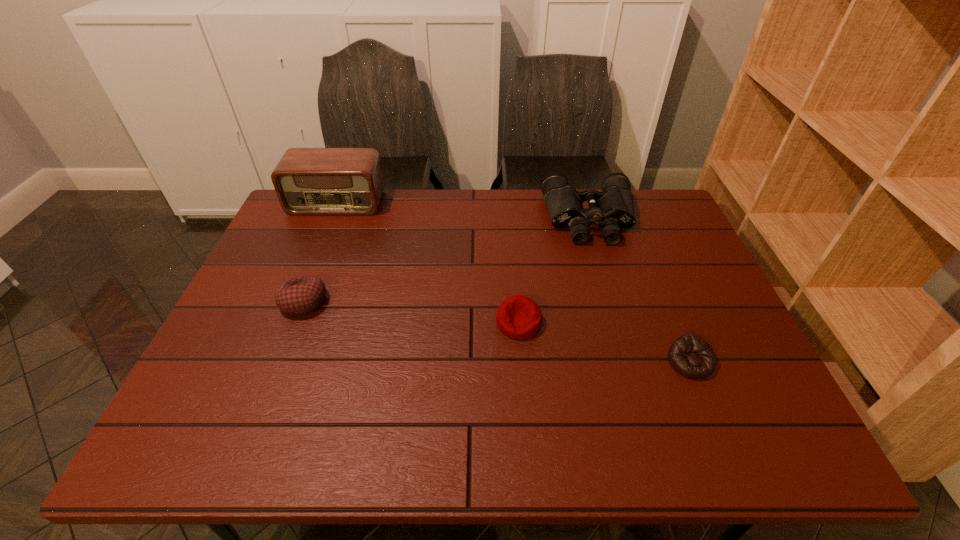
Locate an element on the screen. This screenshot has height=540, width=960. vacant area located on the left of the rightmost beanbag is located at coordinates (577, 362).

In order to click on radio receiver present at the far edge in this screenshot , I will do `click(308, 181)`.

This screenshot has height=540, width=960. What are the coordinates of `binoculars located in the far edge section of the desktop` in the screenshot? It's located at (613, 208).

At what (x,y) coordinates should I click in order to perform the action: click on radio receiver at the left edge. Please return your answer as a coordinate pair (x, y). Image resolution: width=960 pixels, height=540 pixels. Looking at the image, I should click on (308, 181).

Identify the location of beanbag that is at the left edge. This screenshot has width=960, height=540. (300, 295).

Identify the location of binoculars present at the right edge. The height and width of the screenshot is (540, 960). (613, 208).

Find the location of a particular element. beanbag located in the right edge section of the desktop is located at coordinates (689, 355).

At what (x,y) coordinates should I click in order to perform the action: click on object that is at the far left corner. Please return your answer as a coordinate pair (x, y). Image resolution: width=960 pixels, height=540 pixels. Looking at the image, I should click on (308, 181).

Locate an element on the screen. This screenshot has height=540, width=960. object located at the far right corner is located at coordinates (613, 208).

The image size is (960, 540). I want to click on free space at the far edge of the desktop, so click(537, 228).